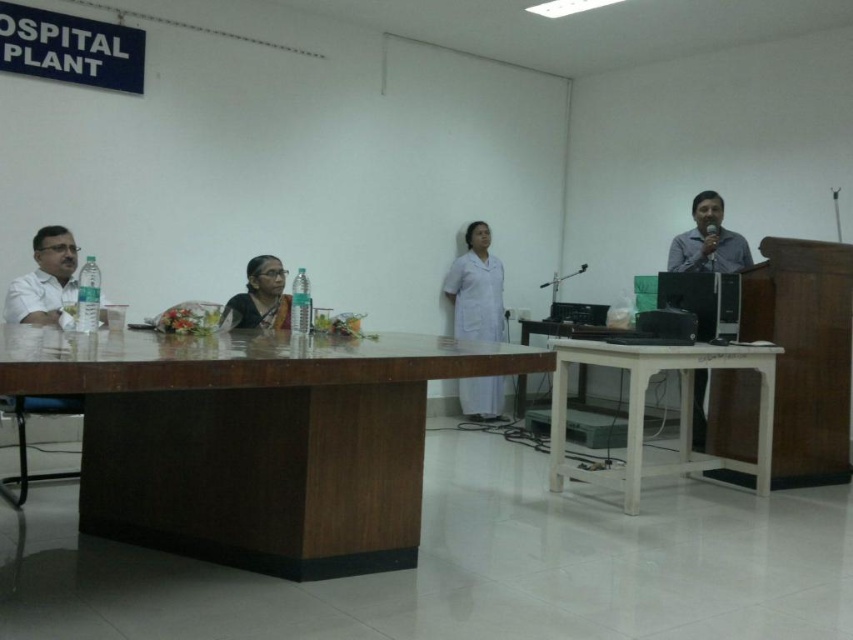
Which is in front, point (305, 419) or point (230, 326)?

Point (305, 419) is more forward.

Between brown wood table at center and satin black saree at center, which one appears on the left side from the viewer's perspective?

From the viewer's perspective, satin black saree at center appears more on the left side.

At what (x,y) coordinates should I click in order to perform the action: click on brown wood table at center. Please return your answer as a coordinate pair (x, y). This screenshot has height=640, width=853. Looking at the image, I should click on (253, 440).

The width and height of the screenshot is (853, 640). Identify the location of brown wood table at center. (253, 440).

Measure the distance between matte gray shirt at right and camera.

→ The distance of matte gray shirt at right from camera is 15.58 feet.

Is point (699, 419) in front of point (241, 307)?

No, (699, 419) is further to viewer.

Locate an element on the screen. This screenshot has width=853, height=640. matte gray shirt at right is located at coordinates (708, 241).

In the scene shown: Who is more distant from viewer, (488, 234) or (274, 259)?

The point (488, 234) is behind.

Is white cloth at center thinner than satin black saree at center?

Incorrect, white cloth at center's width is not less than satin black saree at center's.

Which is behind, point (494, 410) or point (267, 284)?

The point (494, 410) is behind.

Locate an element on the screen. The height and width of the screenshot is (640, 853). white cloth at center is located at coordinates (474, 289).